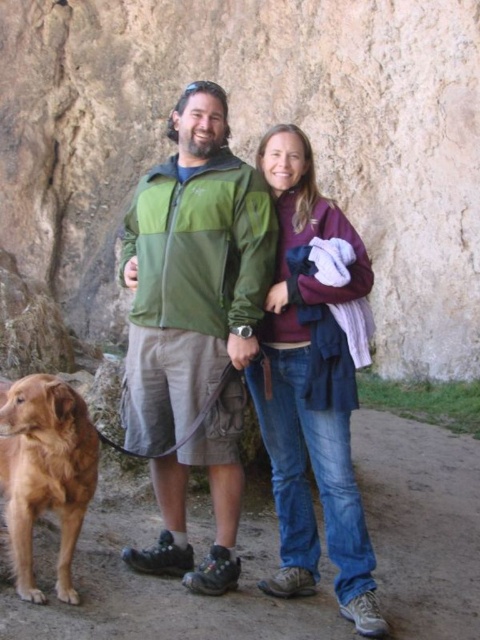
Question: Observing the image, what is the correct spatial positioning of purple fleece jacket at center in reference to golden fur dog at lower left?

Choices:
 (A) left
 (B) right

Answer: (B)

Question: Does purple fleece jacket at center come behind golden fur dog at lower left?

Choices:
 (A) yes
 (B) no

Answer: (A)

Question: Which point is closer to the camera?

Choices:
 (A) green fabric jacket at center
 (B) purple fleece jacket at center
 (C) golden fur dog at lower left

Answer: (C)

Question: Which of these objects is positioned farthest from the green fabric jacket at center?

Choices:
 (A) golden fur dog at lower left
 (B) purple fleece jacket at center

Answer: (A)

Question: Is green fabric jacket at center bigger than golden fur dog at lower left?

Choices:
 (A) no
 (B) yes

Answer: (B)

Question: Which of the following is the farthest from the observer?

Choices:
 (A) purple fleece jacket at center
 (B) golden fur dog at lower left
 (C) green fabric jacket at center

Answer: (C)